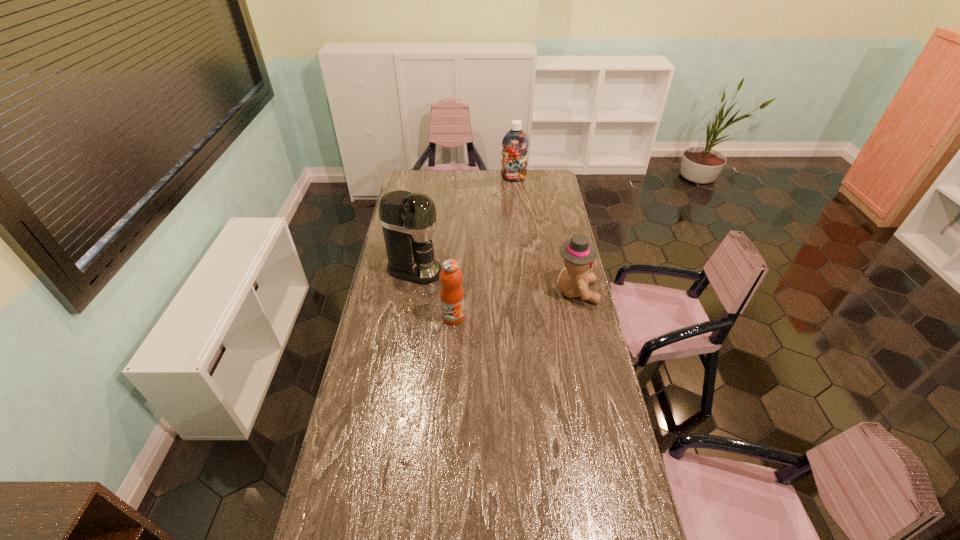
What are the coordinates of `free space located place cup under the spout of the leftmost object` in the screenshot? It's located at (450, 278).

Where is `free location located 0.150m place cup under the spout of the leftmost object`? The width and height of the screenshot is (960, 540). free location located 0.150m place cup under the spout of the leftmost object is located at coordinates (469, 283).

The image size is (960, 540). Identify the location of object that is at the far edge. (515, 143).

Where is `object that is at the left edge`? object that is at the left edge is located at coordinates (408, 220).

This screenshot has width=960, height=540. Identify the location of object that is at the right edge. (579, 254).

Identify the location of vacant area at the far edge. (447, 183).

Where is `vacant region at the near edge`? vacant region at the near edge is located at coordinates (477, 523).

The width and height of the screenshot is (960, 540). What are the coordinates of `vacant space at the right edge` in the screenshot? It's located at (547, 248).

In the image, there is a desktop. Identify the location of free space at the far right corner. This screenshot has width=960, height=540. tap(540, 178).

Identify the location of free space that is in between the rightmost object and the shampoo. The height and width of the screenshot is (540, 960). (544, 235).